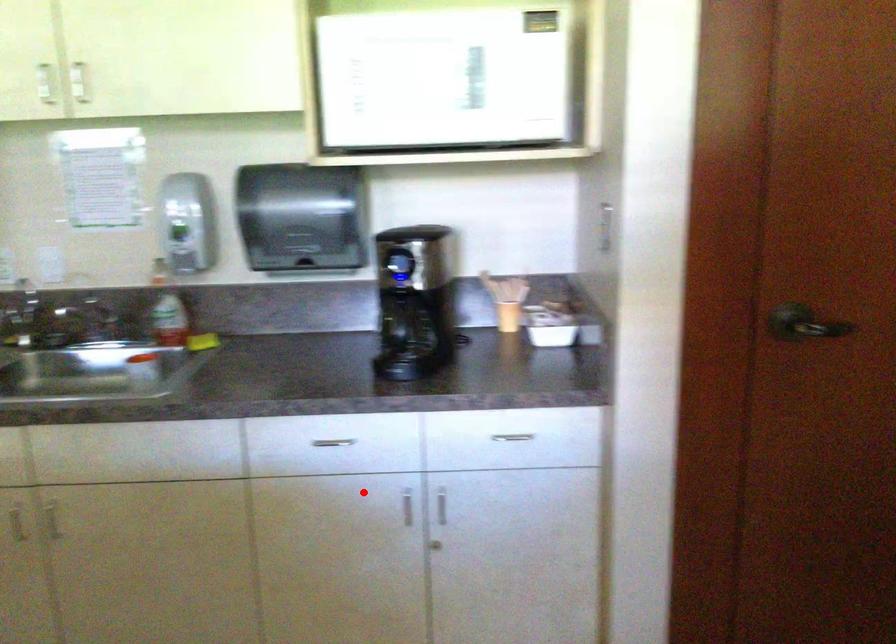
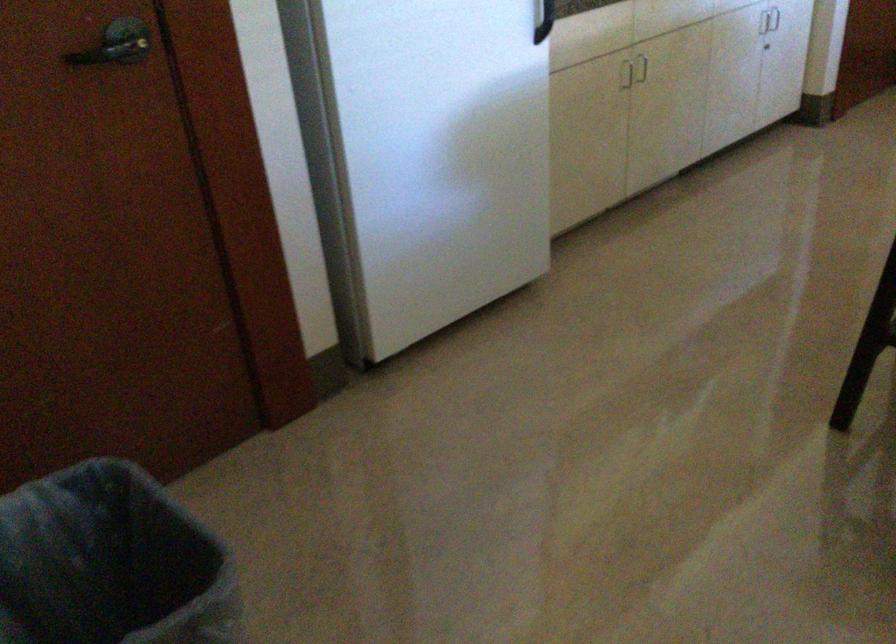
Where in the second image is the point corresponding to the highlighted location from the first image?

(769, 20)